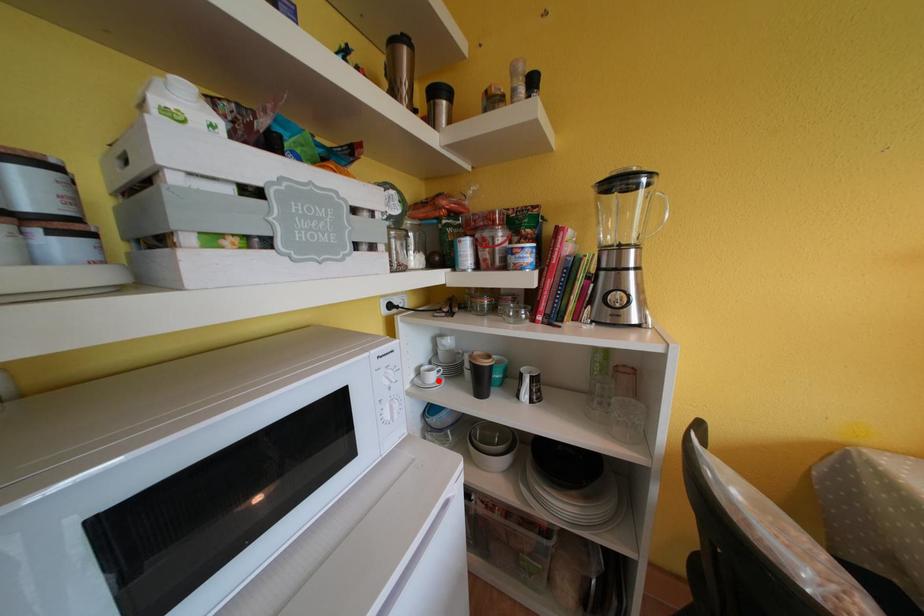
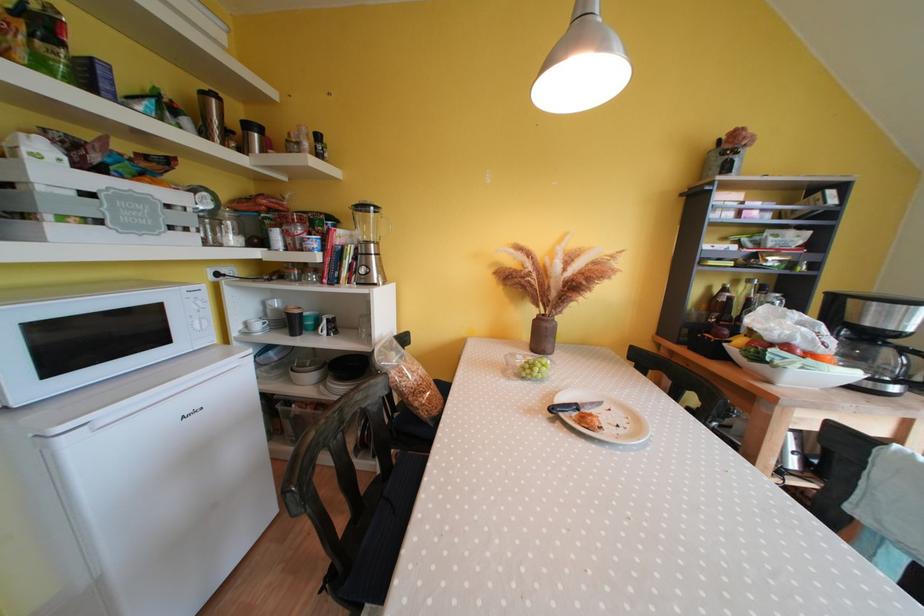
Where in the second image is the point corresponding to the highlighted location from the first image?

(264, 330)